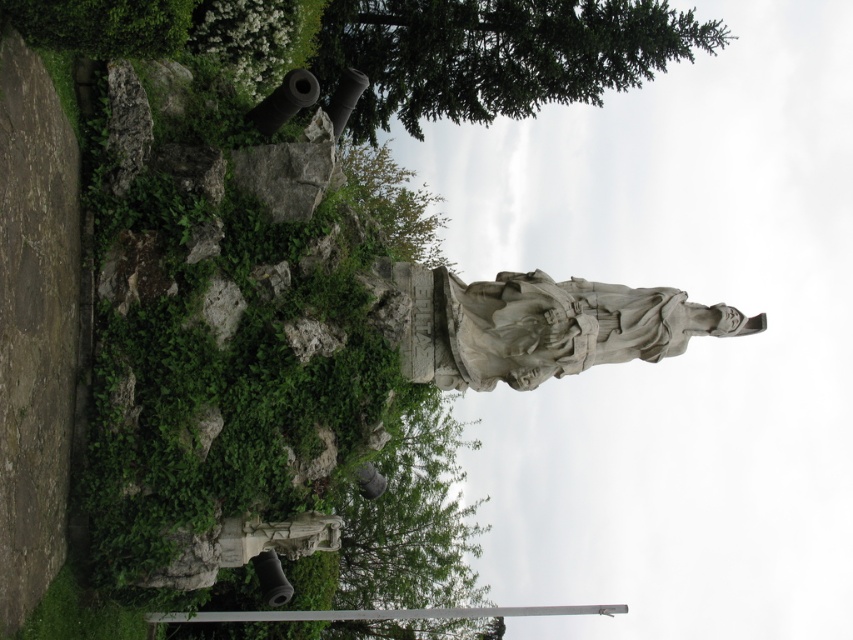
Question: Can you confirm if green leafy tree at upper center is thinner than white stone statue at center?

Choices:
 (A) yes
 (B) no

Answer: (B)

Question: Which object is farther from the camera taking this photo?

Choices:
 (A) white stone statue at center
 (B) green leafy tree at upper center

Answer: (B)

Question: Is green leafy tree at upper center wider than white stone statue at center?

Choices:
 (A) no
 (B) yes

Answer: (B)

Question: Which point is farther to the camera?

Choices:
 (A) (573, 298)
 (B) (599, 28)

Answer: (B)

Question: Can you confirm if green leafy tree at upper center is smaller than white stone statue at center?

Choices:
 (A) no
 (B) yes

Answer: (A)